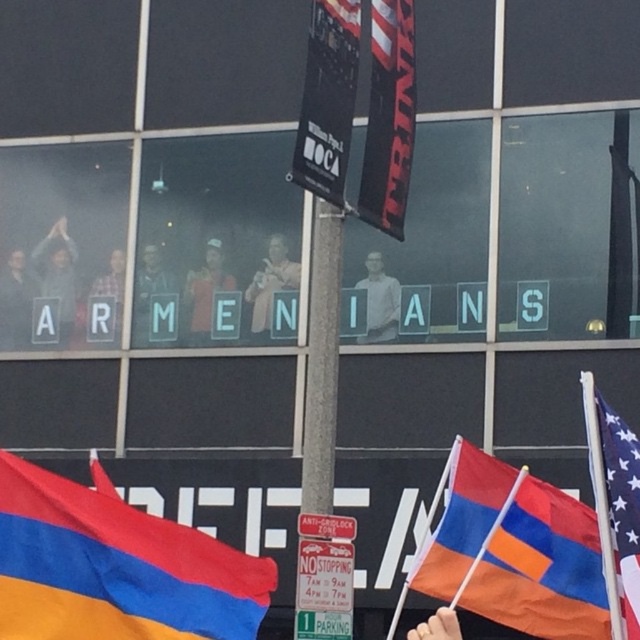
Question: Can you confirm if red fabric flag at center is thinner than dark gray shirt at center?

Choices:
 (A) no
 (B) yes

Answer: (B)

Question: Estimate the real-world distances between objects in this image. Which object is farther from the american flag at right?

Choices:
 (A) matte black jacket at center
 (B) matte black cap at center
 (C) matte black shirt at center

Answer: (A)

Question: Can you confirm if matte black jacket at center is positioned above matte black cap at center?

Choices:
 (A) no
 (B) yes

Answer: (B)

Question: Which point is farther to the camera?

Choices:
 (A) (49, 260)
 (B) (220, 552)

Answer: (A)

Question: Is orange and blue fabric flag at lower left behind dark gray jacket at left?

Choices:
 (A) no
 (B) yes

Answer: (A)

Question: Which point is closer to the camera?

Choices:
 (A) (54, 262)
 (B) (608, 637)
 (C) (202, 272)

Answer: (B)